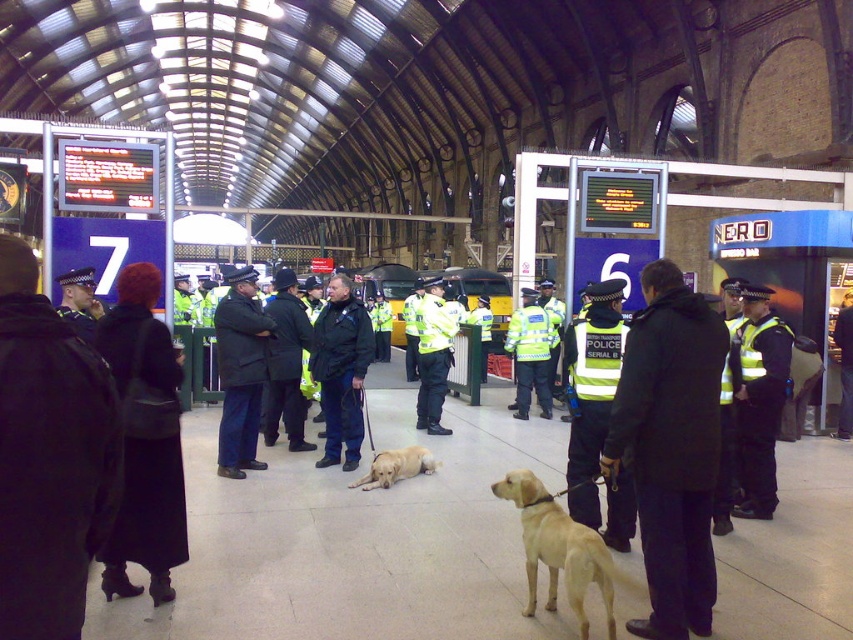
Does yellow reflective vest at center-right have a greater height compared to dark gray uniform at center?

No, yellow reflective vest at center-right is not taller than dark gray uniform at center.

Is point (756, 394) positioned in front of point (225, 476)?

Yes, it is.

Which is in front, point (790, 356) or point (244, 401)?

Positioned in front is point (790, 356).

You are a GUI agent. You are given a task and a screenshot of the screen. Output one action in this format:
    pyautogui.click(x=<x>, y=<y>)
    Task: Click on the yellow reflective vest at center-right
    This screenshot has height=640, width=853.
    Given the screenshot: What is the action you would take?
    pyautogui.click(x=759, y=401)

Is dark gray uniform at center to the right of high-visibility yellow jacket at center from the viewer's perspective?

Incorrect, dark gray uniform at center is not on the right side of high-visibility yellow jacket at center.

Is point (248, 452) positioned in front of point (521, 355)?

Yes, it is.

This screenshot has width=853, height=640. Describe the element at coordinates (241, 371) in the screenshot. I see `dark gray uniform at center` at that location.

Where is `dark gray uniform at center`? The height and width of the screenshot is (640, 853). dark gray uniform at center is located at coordinates (241, 371).

Can you confirm if black wool coat at left is thinner than dark gray uniform at center?

Indeed, black wool coat at left has a lesser width compared to dark gray uniform at center.

Does point (135, 433) lie behind point (219, 348)?

No.

Does point (149, 536) lie behind point (254, 417)?

No, it is in front of (254, 417).

Locate an element on the screen. black wool coat at left is located at coordinates (144, 440).